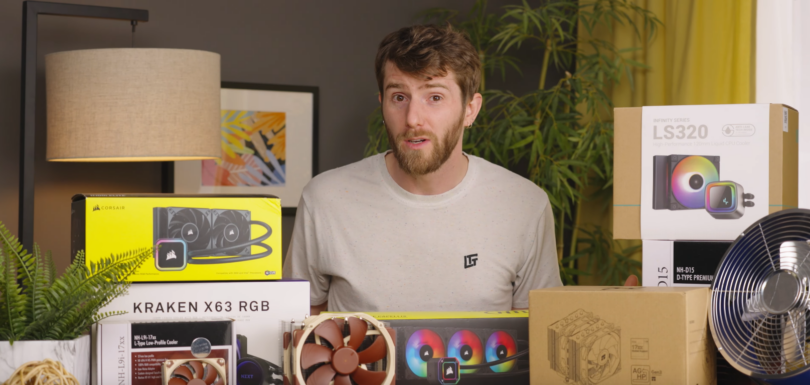
Identify the location of brown fan blades. (343, 363).